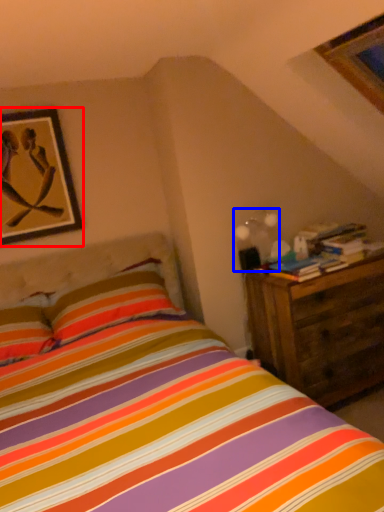
Question: Among these objects, which one is farthest to the camera, picture frame (highlighted by a red box) or light fixture (highlighted by a blue box)?

Choices:
 (A) picture frame
 (B) light fixture

Answer: (B)